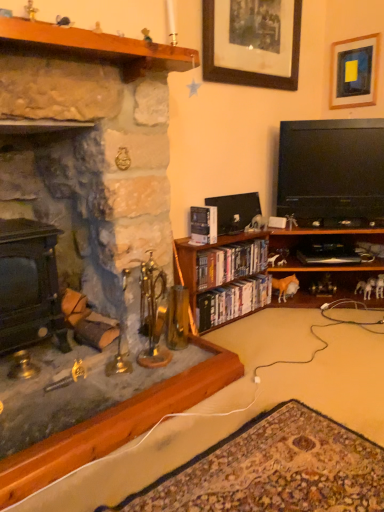
Image resolution: width=384 pixels, height=512 pixels. I want to click on wooden picture frame at upper right, the 2th picture frame positioned from the left, so click(354, 72).

The width and height of the screenshot is (384, 512). Describe the element at coordinates (332, 172) in the screenshot. I see `black glossy flat-screen tv at right` at that location.

Find the location of a particular element. matte black stove at left, the first fireplace in the left-to-right sequence is located at coordinates (29, 285).

At what (x,y) coordinates should I click in order to perform the action: click on hardcover book at center, the third book ordered from the bottom. Please return your answer as a coordinate pair (x, y). The width and height of the screenshot is (384, 512). Looking at the image, I should click on (203, 225).

This screenshot has height=512, width=384. What do you see at coordinates (95, 47) in the screenshot?
I see `wooden at left` at bounding box center [95, 47].

At what (x,y) coordinates should I click in order to perform the action: click on matte black fireplace at left, placed as the second fireplace when sorted from left to right. Please return your answer as a coordinate pair (x, y). This screenshot has height=512, width=384. Looking at the image, I should click on (84, 246).

Considering the sizes of hardcover book at center, which is the 1th book in top-to-bottom order, and black glossy flat-screen tv at right in the image, is hardcover book at center, which is the 1th book in top-to-bottom order, taller or shorter than black glossy flat-screen tv at right?

Clearly, hardcover book at center, which is the 1th book in top-to-bottom order, is shorter compared to black glossy flat-screen tv at right.

Is hardcover book at center, which is the 1th book in top-to-bottom order, placed right next to black glossy flat-screen tv at right?

hardcover book at center, which is the 1th book in top-to-bottom order, and black glossy flat-screen tv at right are clearly separated.

Which object is positioned more to the left, hardcover book at center, which is the 1th book in top-to-bottom order, or black glossy flat-screen tv at right?

hardcover book at center, which is the 1th book in top-to-bottom order, is more to the left.

Does point (195, 237) come behind point (284, 170)?

No, it is in front of (284, 170).

Is wooden picture frame at upper right, the 2th picture frame positioned from the left, a part of black glossy flat-screen tv at right?

No, wooden picture frame at upper right, the 2th picture frame positioned from the left, is not a part of black glossy flat-screen tv at right.

Is black glossy flat-screen tv at right next to wooden picture frame at upper right, which is counted as the first picture frame, starting from the right, and touching it?

They are not placed beside each other.

Based on their sizes in the image, would you say black glossy flat-screen tv at right is bigger or smaller than wooden picture frame at upper right, the 2th picture frame positioned from the left?

Clearly, black glossy flat-screen tv at right is larger in size than wooden picture frame at upper right, the 2th picture frame positioned from the left.

From the image's perspective, which is above, wooden picture frame at upper right, the 2th picture frame positioned from the left, or matte black fireplace at left, which appears as the first fireplace when viewed from the right?

wooden picture frame at upper right, the 2th picture frame positioned from the left, is shown above in the image.

Is wooden picture frame at upper right, which is counted as the first picture frame, starting from the right, oriented away from matte black fireplace at left, which appears as the first fireplace when viewed from the right?

No.

Which is more to the right, wooden picture frame at upper right, which is counted as the first picture frame, starting from the right, or matte black fireplace at left, which appears as the first fireplace when viewed from the right?

wooden picture frame at upper right, which is counted as the first picture frame, starting from the right.

Considering the positions of point (346, 85) and point (128, 430), is point (346, 85) closer or farther from the camera than point (128, 430)?

Point (346, 85) is farther from the camera than point (128, 430).

Considering the relative sizes of matte black stove at left, arranged as the 2th fireplace when viewed from the right, and matte plastic books at center, acting as the second book starting from the top, in the image provided, is matte black stove at left, arranged as the 2th fireplace when viewed from the right, smaller than matte plastic books at center, acting as the second book starting from the top,?

Actually, matte black stove at left, arranged as the 2th fireplace when viewed from the right, might be larger than matte plastic books at center, acting as the second book starting from the top.

Can you confirm if matte black stove at left, arranged as the 2th fireplace when viewed from the right, is wider than matte plastic books at center, acting as the second book starting from the top?

Yes.

Which book is the 2nd one when counting from the back of the matte black stove at left, arranged as the 2th fireplace when viewed from the right? Please provide its 2D coordinates.

[(230, 262)]

Does point (203, 74) lie in front of point (181, 248)?

No, it is behind (181, 248).

Considering the sizes of objects wooden picture frame at upper center, placed as the first picture frame when sorted from left to right, and wooden bookshelf at lower center in the image provided, who is smaller, wooden picture frame at upper center, placed as the first picture frame when sorted from left to right, or wooden bookshelf at lower center?

Smaller between the two is wooden picture frame at upper center, placed as the first picture frame when sorted from left to right.

Between wooden picture frame at upper center, the second picture frame from the right, and wooden bookshelf at lower center, which one has more height?

Standing taller between the two is wooden picture frame at upper center, the second picture frame from the right.

From a real-world perspective, which is physically below, wooden picture frame at upper center, placed as the first picture frame when sorted from left to right, or wooden bookshelf at lower center?

wooden bookshelf at lower center.

Does black glossy flat-screen tv at right have a smaller size compared to hardcover books at center, arranged as the first book when ordered from the bottom?

No.

Is black glossy flat-screen tv at right taller or shorter than hardcover books at center, arranged as the first book when ordered from the bottom?

black glossy flat-screen tv at right is taller than hardcover books at center, arranged as the first book when ordered from the bottom.

Based on the photo, considering the relative sizes of black glossy flat-screen tv at right and hardcover books at center, arranged as the first book when ordered from the bottom, in the image provided, is black glossy flat-screen tv at right thinner than hardcover books at center, arranged as the first book when ordered from the bottom,?

No, black glossy flat-screen tv at right is not thinner than hardcover books at center, arranged as the first book when ordered from the bottom.

Which is closer to the camera, (281,193) or (216,289)?

The point (216,289) is closer to the camera.

In the scene shown: Would you say hardcover book at center, the third book ordered from the bottom, is to the left or to the right of matte plastic books at center, acting as the second book starting from the bottom, in the picture?

From the image, it's evident that hardcover book at center, the third book ordered from the bottom, is to the left of matte plastic books at center, acting as the second book starting from the bottom.

Which of these two, hardcover book at center, the third book ordered from the bottom, or matte plastic books at center, acting as the second book starting from the top, is smaller?

Smaller between the two is hardcover book at center, the third book ordered from the bottom.

Does hardcover book at center, which is the 1th book in top-to-bottom order, have a lesser width compared to matte plastic books at center, acting as the second book starting from the top?

No, hardcover book at center, which is the 1th book in top-to-bottom order, is not thinner than matte plastic books at center, acting as the second book starting from the top.

Identify the location of television above the hardcover book at center, the third book ordered from the bottom (from the image's perspective). coord(332,172).

This screenshot has height=512, width=384. What are the coordinates of `television on the left of wooden picture frame at upper right, the 2th picture frame positioned from the left` in the screenshot? It's located at (332, 172).

From the picture: From the image, which object appears to be nearer to hardcover book at center, which is the 1th book in top-to-bottom order, hardcover books at center, arranged as the third book when viewed from the top, or matte black stove at left, the first fireplace in the left-to-right sequence?

hardcover books at center, arranged as the third book when viewed from the top, is positioned closer to the anchor hardcover book at center, which is the 1th book in top-to-bottom order.

From the picture: From the image, which object appears to be farther from hardcover book at center, the third book ordered from the bottom, matte plastic books at center, acting as the second book starting from the bottom, or wooden bookshelf at lower center?

wooden bookshelf at lower center is positioned further to the anchor hardcover book at center, the third book ordered from the bottom.

In the scene shown: Looking at the image, which one is located further to black glossy flat-screen tv at right, hardcover books at center, arranged as the first book when ordered from the bottom, or wooden bookshelf at lower center?

Based on the image, hardcover books at center, arranged as the first book when ordered from the bottom, appears to be further to black glossy flat-screen tv at right.

Which object lies nearer to the anchor point wooden bookshelf at lower center, hardcover books at center, arranged as the first book when ordered from the bottom, or matte black fireplace at left, placed as the second fireplace when sorted from left to right?

hardcover books at center, arranged as the first book when ordered from the bottom, lies closer to wooden bookshelf at lower center than the other object.

Based on the photo, which object lies further to the anchor point wooden at left, hardcover books at center, arranged as the first book when ordered from the bottom, or matte black fireplace at left, placed as the second fireplace when sorted from left to right?

The object further to wooden at left is hardcover books at center, arranged as the first book when ordered from the bottom.

In the scene shown: Based on their spatial positions, is wooden at left or wooden picture frame at upper center, placed as the first picture frame when sorted from left to right, closer to matte black fireplace at left, which appears as the first fireplace when viewed from the right?

wooden at left lies closer to matte black fireplace at left, which appears as the first fireplace when viewed from the right, than the other object.

Based on their spatial positions, is wooden picture frame at upper center, placed as the first picture frame when sorted from left to right, or matte plastic books at center, acting as the second book starting from the top, closer to wooden bookshelf at lower center?

The object closer to wooden bookshelf at lower center is matte plastic books at center, acting as the second book starting from the top.

From the image, which object appears to be farther from matte plastic books at center, acting as the second book starting from the top, black glossy flat-screen tv at right or wooden picture frame at upper right, the 2th picture frame positioned from the left?

wooden picture frame at upper right, the 2th picture frame positioned from the left, is further to matte plastic books at center, acting as the second book starting from the top.

Locate an element on the screen. The width and height of the screenshot is (384, 512). shelf between matte black fireplace at left, placed as the second fireplace when sorted from left to right, and hardcover books at center, arranged as the third book when viewed from the top, along the z-axis is located at coordinates (95, 47).

I want to click on cabinetry between black glossy flat-screen tv at right and hardcover books at center, arranged as the third book when viewed from the top, from top to bottom, so click(x=186, y=270).

Where is `shelf between matte black fireplace at left, placed as the second fireplace when sorted from left to right, and wooden picture frame at upper right, which is counted as the first picture frame, starting from the right, along the z-axis`? shelf between matte black fireplace at left, placed as the second fireplace when sorted from left to right, and wooden picture frame at upper right, which is counted as the first picture frame, starting from the right, along the z-axis is located at coordinates (95, 47).

I want to click on fireplace between matte black fireplace at left, which appears as the first fireplace when viewed from the right, and matte plastic books at center, acting as the second book starting from the bottom, in the front-back direction, so click(29, 285).